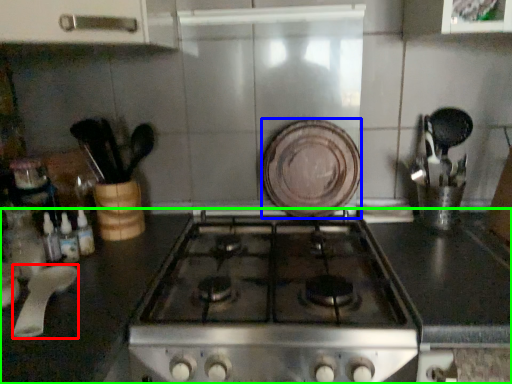
Question: Considering the real-world distances, which object is closest to kitchen appliance (highlighted by a red box)? plate (highlighted by a blue box) or countertop (highlighted by a green box).

Choices:
 (A) plate
 (B) countertop

Answer: (B)